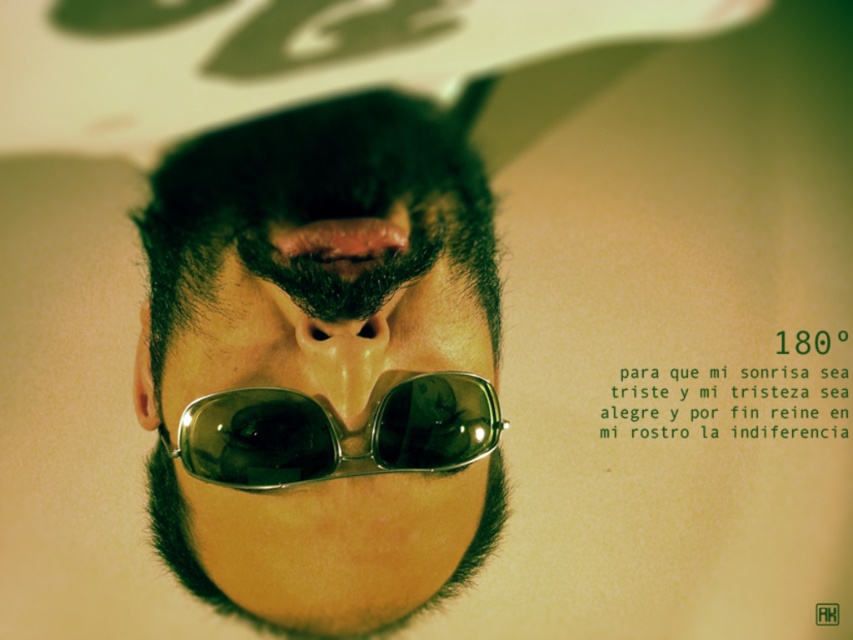
Question: Based on their relative distances, which object is nearer to the smokey gray metallic goggles at center?

Choices:
 (A) shiny metallic sunglasses at center
 (B) matte brown nose at center

Answer: (B)

Question: Which point is farther to the camera?

Choices:
 (A) shiny metallic sunglasses at center
 (B) matte brown nose at center

Answer: (B)

Question: Which object is the farthest from the smokey gray metallic goggles at center?

Choices:
 (A) shiny metallic sunglasses at center
 (B) matte brown nose at center

Answer: (A)

Question: Where is shiny metallic sunglasses at center located in relation to smokey gray metallic goggles at center in the image?

Choices:
 (A) left
 (B) right

Answer: (A)

Question: From the image, what is the correct spatial relationship of shiny metallic sunglasses at center in relation to smokey gray metallic goggles at center?

Choices:
 (A) above
 (B) below

Answer: (A)

Question: Does shiny metallic sunglasses at center appear on the left side of smokey gray metallic goggles at center?

Choices:
 (A) no
 (B) yes

Answer: (B)